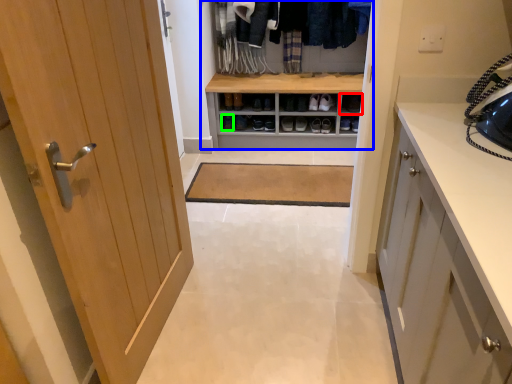
Question: Which object is the farthest from shelf (highlighted by a red box)? Choose among these: dresser (highlighted by a blue box) or shoe (highlighted by a green box).

Choices:
 (A) dresser
 (B) shoe

Answer: (B)